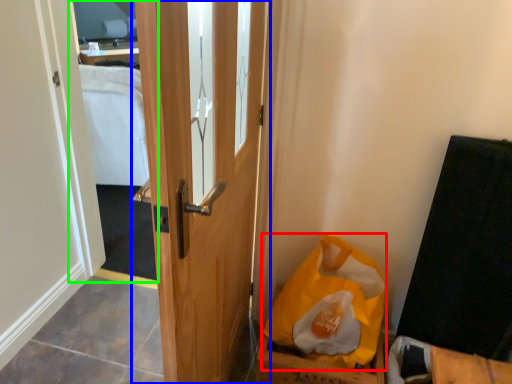
Question: Which is nearer to the paper bag (highlighted by a red box)? door (highlighted by a blue box) or mirror (highlighted by a green box).

Choices:
 (A) door
 (B) mirror

Answer: (A)